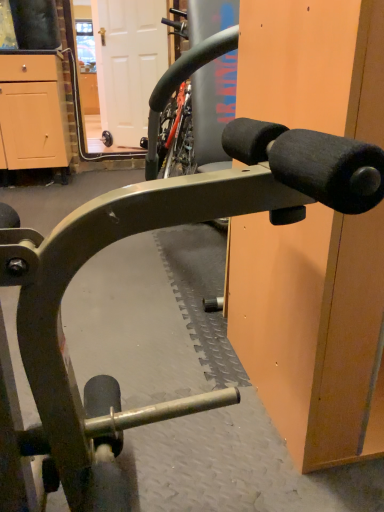
What do you see at coordinates (33, 112) in the screenshot? I see `light wood cabinet at left` at bounding box center [33, 112].

Locate an element on the screen. The height and width of the screenshot is (512, 384). light wood cabinet at left is located at coordinates coord(33,112).

What is the approximate height of white matte door at upper center?

white matte door at upper center is 4.20 feet in height.

Where is `white matte door at upper center`? This screenshot has height=512, width=384. white matte door at upper center is located at coordinates (128, 64).

Image resolution: width=384 pixels, height=512 pixels. What do you see at coordinates (128, 64) in the screenshot?
I see `white matte door at upper center` at bounding box center [128, 64].

At what (x,y) coordinates should I click in order to perform the action: click on light wood cabinet at left. Please return your answer as a coordinate pair (x, y). The height and width of the screenshot is (512, 384). Looking at the image, I should click on (33, 112).

Does light wood cabinet at left appear on the left side of white matte door at upper center?

Correct, you'll find light wood cabinet at left to the left of white matte door at upper center.

Is light wood cabinet at left further to the viewer compared to white matte door at upper center?

No, it is in front of white matte door at upper center.

Considering the positions of point (5, 89) and point (139, 108), is point (5, 89) closer or farther from the camera than point (139, 108)?

Clearly, point (5, 89) is closer to the camera than point (139, 108).

From the image's perspective, between light wood cabinet at left and white matte door at upper center, who is located below?

light wood cabinet at left, from the image's perspective.

From the picture: From a real-world perspective, which object stands above the other?

In real-world perspective, white matte door at upper center is above.

Which of these two, light wood cabinet at left or white matte door at upper center, is wider?

Wider between the two is light wood cabinet at left.

In the scene shown: In terms of height, does light wood cabinet at left look taller or shorter compared to white matte door at upper center?

Considering their sizes, light wood cabinet at left has less height than white matte door at upper center.

Can you confirm if light wood cabinet at left is bigger than white matte door at upper center?

Yes, light wood cabinet at left is bigger than white matte door at upper center.

Would you say light wood cabinet at left contains white matte door at upper center?

No, white matte door at upper center is located outside of light wood cabinet at left.

Based on the photo, is light wood cabinet at left far from white matte door at upper center?

Yes, light wood cabinet at left and white matte door at upper center are located far from each other.

Could you tell me if light wood cabinet at left is facing white matte door at upper center?

No, light wood cabinet at left is not oriented towards white matte door at upper center.

How different are the orientations of light wood cabinet at left and white matte door at upper center in degrees?

The angle between the facing direction of light wood cabinet at left and the facing direction of white matte door at upper center is 44.3 degrees.

The image size is (384, 512). Find the location of `door on the right of the light wood cabinet at left`. door on the right of the light wood cabinet at left is located at coordinates (128, 64).

Does white matte door at upper center appear on the left side of light wood cabinet at left?

No, white matte door at upper center is not to the left of light wood cabinet at left.

Is white matte door at upper center positioned in front of light wood cabinet at left?

No, white matte door at upper center is behind light wood cabinet at left.

Between point (165, 54) and point (49, 140), which one is positioned behind?

The point (165, 54) is behind.

From the image's perspective, between white matte door at upper center and light wood cabinet at left, which one is located above?

white matte door at upper center, from the image's perspective.

From a real-world perspective, which object stands above the other?

white matte door at upper center.

Between white matte door at upper center and light wood cabinet at left, which one has smaller width?

Thinner between the two is white matte door at upper center.

Considering the sizes of objects white matte door at upper center and light wood cabinet at left in the image provided, who is taller, white matte door at upper center or light wood cabinet at left?

white matte door at upper center.

Is white matte door at upper center bigger than light wood cabinet at left?

No, white matte door at upper center is not bigger than light wood cabinet at left.

Can we say white matte door at upper center lies outside light wood cabinet at left?

That's correct, white matte door at upper center is outside of light wood cabinet at left.

Looking at this image, would you consider white matte door at upper center to be distant from light wood cabinet at left?

Yes, white matte door at upper center is far from light wood cabinet at left.

Could you tell me if white matte door at upper center is turned towards light wood cabinet at left?

Yes, white matte door at upper center is turned towards light wood cabinet at left.

How many degrees apart are the facing directions of white matte door at upper center and light wood cabinet at left?

The angle between the facing direction of white matte door at upper center and the facing direction of light wood cabinet at left is 44.3 degrees.

Locate an element on the screen. The image size is (384, 512). cabinetry located below the white matte door at upper center (from the image's perspective) is located at coordinates (33, 112).

This screenshot has height=512, width=384. In order to click on door on the right of light wood cabinet at left in this screenshot , I will do `click(128, 64)`.

Where is `door behind the light wood cabinet at left`? The height and width of the screenshot is (512, 384). door behind the light wood cabinet at left is located at coordinates (128, 64).